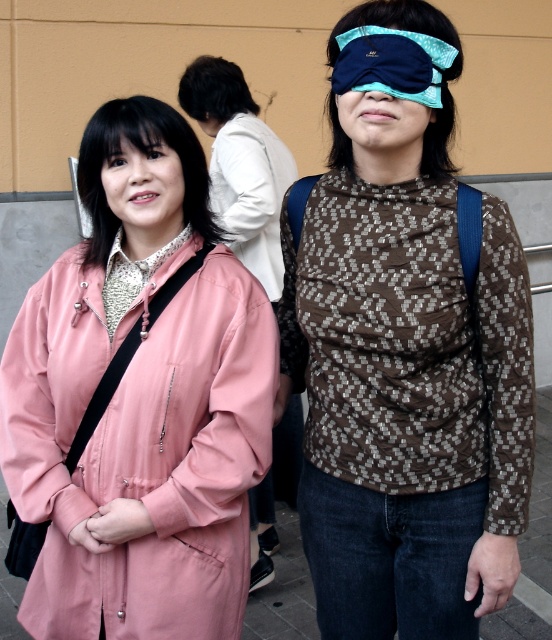
Based on the scene description, can you determine if the blue fabric blindfold at upper center can fully cover the dark brown hair at upper center?

The blue fabric blindfold at upper center is narrower than the dark brown hair at upper center, so it cannot fully cover the dark brown hair at upper center.

You are a photographer trying to decide which object to focus on for a closeup shot. Given that the pink matte jacket at left and the matte blue fabric eye mask at center are both in the frame, which one would you choose if you want to capture more details of the object?

The pink matte jacket at left is bigger than the matte blue fabric eye mask at center, so focusing on the pink matte jacket at left would allow capturing more details due to its larger size.

Please provide the 2D coordinates of the pink matte jacket at left in the image coordinate system where the origin is at the bottom left corner of the image.

The 2D coordinates of the pink matte jacket at left are at point (241, 164).